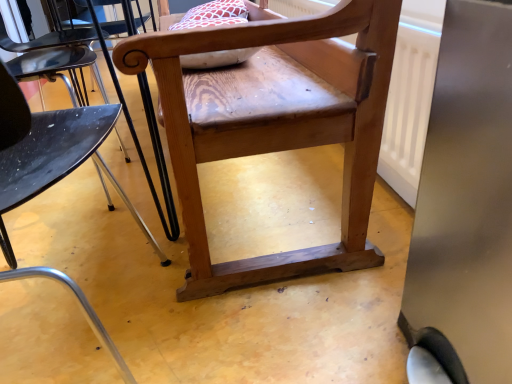
Question: From their relative heights in the image, would you say natural wood chair at center, the 1th chair viewed from the back, is taller or shorter than wooden chair at center, arranged as the 1th chair when viewed from the front?

Choices:
 (A) tall
 (B) short

Answer: (B)

Question: From the image's perspective, relative to wooden chair at center, arranged as the 1th chair when viewed from the front, is natural wood chair at center, the 1th chair viewed from the back, above or below?

Choices:
 (A) above
 (B) below

Answer: (A)

Question: Considering the positions of natural wood chair at center, the 1th chair viewed from the back, and wooden chair at center, arranged as the 1th chair when viewed from the front, in the image, is natural wood chair at center, the 1th chair viewed from the back, wider or thinner than wooden chair at center, arranged as the 1th chair when viewed from the front,?

Choices:
 (A) wide
 (B) thin

Answer: (A)

Question: Based on their positions, is wooden chair at center, which appears as the 2th chair when viewed from the back, located to the left or right of natural wood chair at center, arranged as the second chair when viewed from the front?

Choices:
 (A) right
 (B) left

Answer: (B)

Question: From a real-world perspective, is wooden chair at center, which appears as the 2th chair when viewed from the back, physically located above or below natural wood chair at center, arranged as the second chair when viewed from the front?

Choices:
 (A) below
 (B) above

Answer: (B)

Question: Relative to natural wood chair at center, the 1th chair viewed from the back, is wooden chair at center, which appears as the 2th chair when viewed from the back, in front or behind?

Choices:
 (A) behind
 (B) front

Answer: (B)

Question: Considering the positions of wooden chair at center, arranged as the 1th chair when viewed from the front, and natural wood chair at center, arranged as the second chair when viewed from the front, in the image, is wooden chair at center, arranged as the 1th chair when viewed from the front, taller or shorter than natural wood chair at center, arranged as the second chair when viewed from the front,?

Choices:
 (A) short
 (B) tall

Answer: (B)